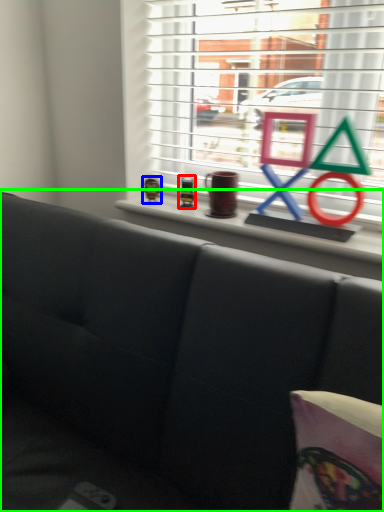
Question: Which object is the closest to the toy (highlighted by a red box)? Choose among these: toy (highlighted by a blue box) or studio couch (highlighted by a green box).

Choices:
 (A) toy
 (B) studio couch

Answer: (A)